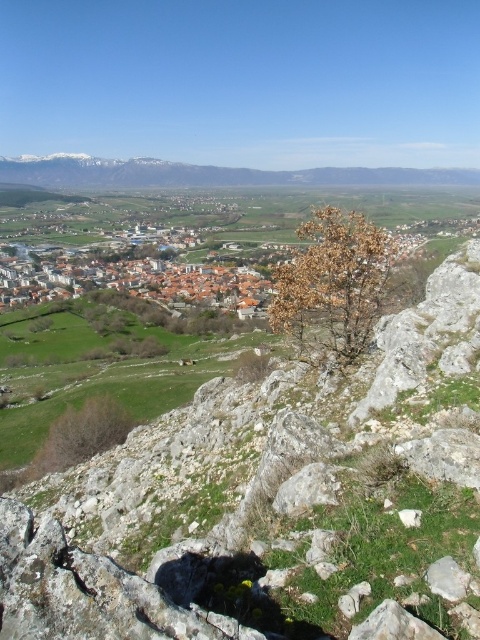
Question: Does green grassy hill at center appear under brown leafless shrub at lower left?

Choices:
 (A) no
 (B) yes

Answer: (A)

Question: Among these points, which one is farthest from the camera?

Choices:
 (A) (458, 580)
 (B) (310, 320)
 (C) (126, 416)
 (D) (80, 163)

Answer: (D)

Question: Does brown leafy tree at center have a lesser width compared to gray rough stone at lower right?

Choices:
 (A) no
 (B) yes

Answer: (A)

Question: Which point is closer to the camera taking this photo?

Choices:
 (A) pyautogui.click(x=212, y=182)
 (B) pyautogui.click(x=357, y=339)

Answer: (B)

Question: Can you confirm if green grassy hill at center is smaller than brown leafless shrub at lower left?

Choices:
 (A) no
 (B) yes

Answer: (A)

Question: Which of these objects is positioned farthest from the green grassy hill at center?

Choices:
 (A) gray rough stone at lower right
 (B) brown leafy tree at center
 (C) white snow-covered mountain at center
 (D) brown leafless shrub at lower left

Answer: (C)